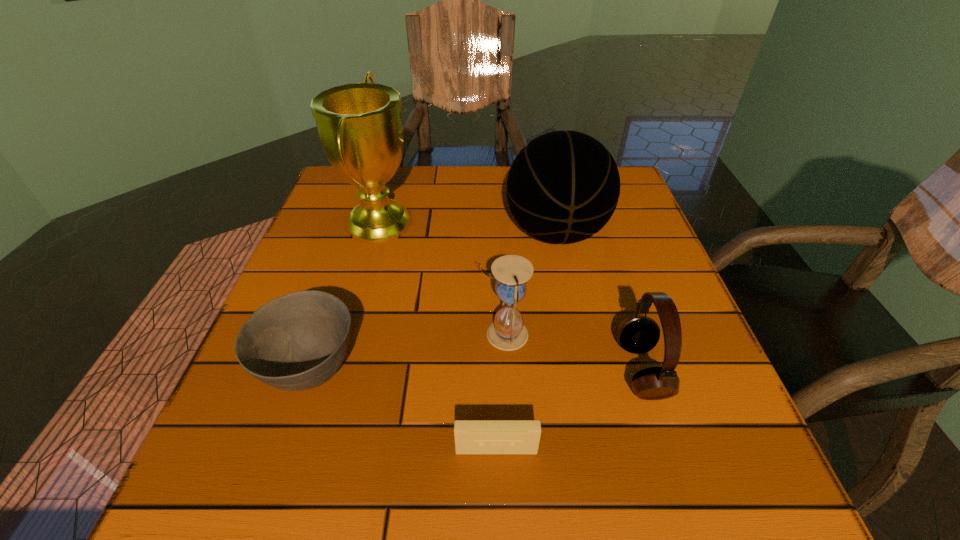
Where is `vacant region located 0.270m on the ear pads of the headset`? The width and height of the screenshot is (960, 540). vacant region located 0.270m on the ear pads of the headset is located at coordinates (465, 370).

The height and width of the screenshot is (540, 960). Find the location of `blank space located 0.120m on the ear pads of the headset`. blank space located 0.120m on the ear pads of the headset is located at coordinates (551, 370).

I want to click on vacant area situated 0.220m on the ear pads of the headset, so click(493, 370).

Where is `vacant region located 0.050m on the right of the fifth tallest object`? Image resolution: width=960 pixels, height=540 pixels. vacant region located 0.050m on the right of the fifth tallest object is located at coordinates [389, 368].

Locate an element on the screen. The height and width of the screenshot is (540, 960). free space located 0.090m at the front of the videotape with spools is located at coordinates (498, 522).

The height and width of the screenshot is (540, 960). In order to click on award that is at the far edge in this screenshot , I will do `click(360, 127)`.

At what (x,y) coordinates should I click in order to perform the action: click on basketball located in the far edge section of the desktop. Please return your answer as a coordinate pair (x, y). Looking at the image, I should click on (563, 187).

Identify the location of award at the left edge. (360, 127).

You are a GUI agent. You are given a task and a screenshot of the screen. Output one action in this format:
    pyautogui.click(x=<x>, y=<y>)
    Task: Click on the bowl at the left edge
    
    Given the screenshot: What is the action you would take?
    pyautogui.click(x=298, y=341)

Find the location of a particular element. basketball present at the right edge is located at coordinates (563, 187).